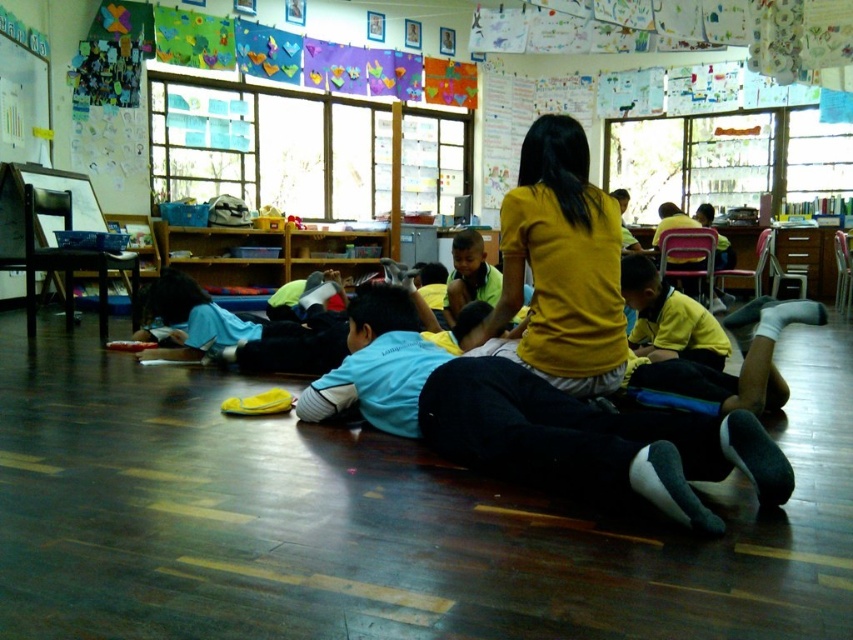
Can you confirm if blue fabric shirt at center is smaller than yellow matte shirt at center?

No.

Which is above, blue fabric shirt at center or yellow matte shirt at center?

yellow matte shirt at center is above.

Is point (662, 442) positioned after point (582, 205)?

No, (662, 442) is closer to viewer.

At what (x,y) coordinates should I click in order to perform the action: click on blue fabric shirt at center. Please return your answer as a coordinate pair (x, y). The image size is (853, 640). Looking at the image, I should click on (535, 420).